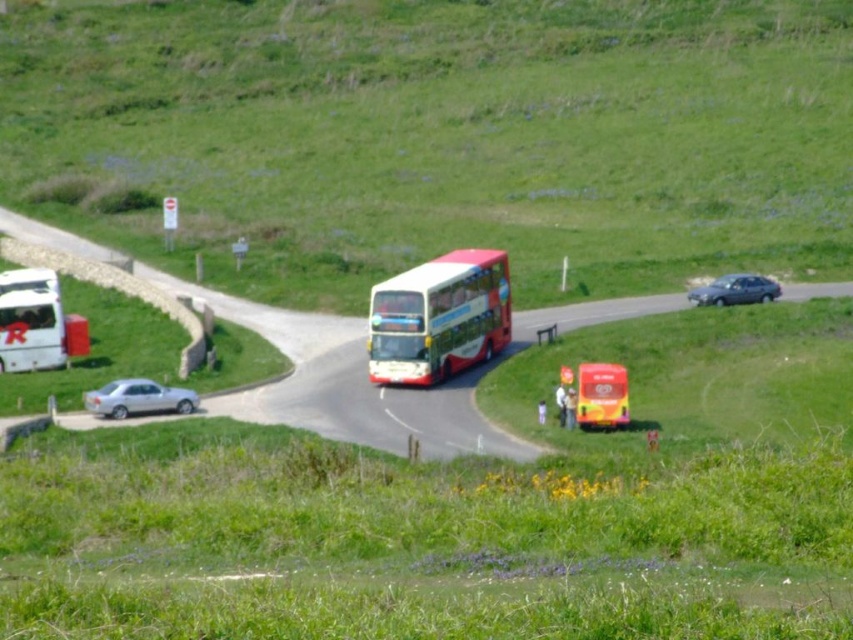
Question: Is metallic silver car at left wider than silver metallic car at lower left?

Choices:
 (A) no
 (B) yes

Answer: (B)

Question: Which object is closer to the camera taking this photo?

Choices:
 (A) metallic gray sedan at right
 (B) shiny red bus at center

Answer: (B)

Question: Based on their relative distances, which object is farther from the silver metallic car at lower left?

Choices:
 (A) white glossy bus at center
 (B) metallic gray sedan at right
 (C) white matte van at left

Answer: (B)

Question: Considering the real-world distances, which object is closest to the shiny red bus at center?

Choices:
 (A) white glossy bus at center
 (B) silver metallic car at lower left

Answer: (A)

Question: In this image, where is white glossy bus at center located relative to white matte van at left?

Choices:
 (A) above
 (B) below

Answer: (B)

Question: Does white matte van at left appear on the right side of shiny red bus at center?

Choices:
 (A) yes
 (B) no

Answer: (B)